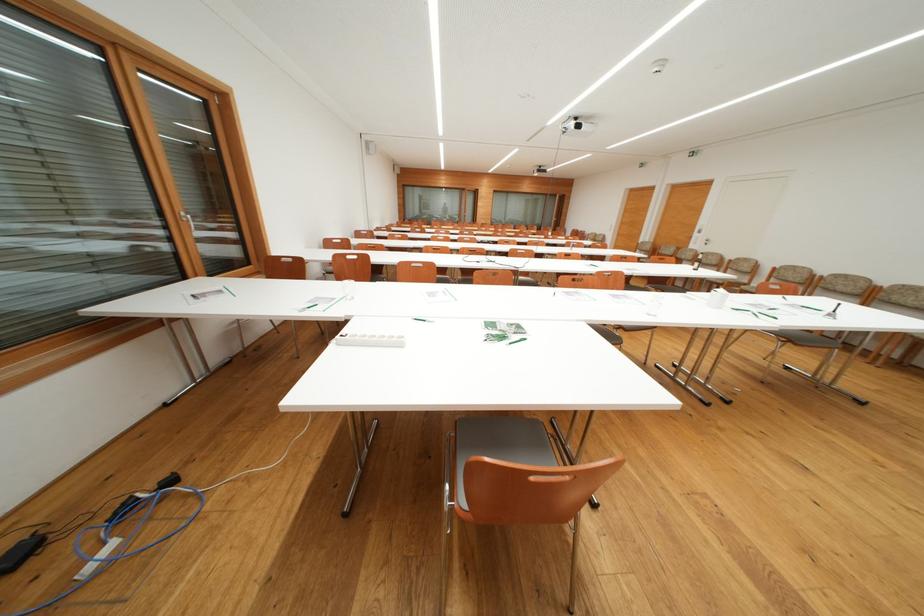
The height and width of the screenshot is (616, 924). What do you see at coordinates (523, 442) in the screenshot? I see `a chair sitting surface` at bounding box center [523, 442].